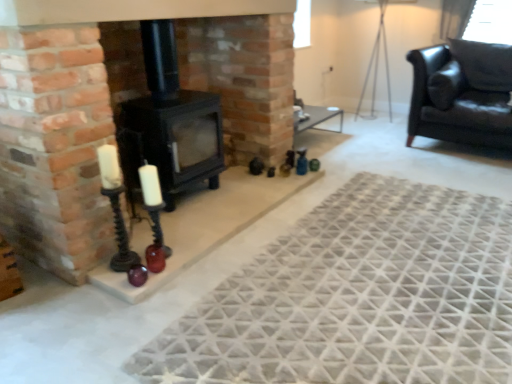
Question: Does point (128, 261) appear closer or farther from the camera than point (468, 274)?

Choices:
 (A) closer
 (B) farther

Answer: (B)

Question: From a real-world perspective, relative to textured gray rug at center, is black wrought iron candle holder at left, marked as the 1th candle holder in a left-to-right arrangement, vertically above or below?

Choices:
 (A) above
 (B) below

Answer: (A)

Question: Estimate the real-world distances between objects in this image. Which object is closer to the black wrought iron candle holder at left, marked as the 1th candle holder in a left-to-right arrangement?

Choices:
 (A) black glass candle holder at lower left, positioned as the 2th candle holder in left-to-right order
 (B) black matte wood burning stove at center
 (C) textured gray rug at center
 (D) black leather couch at upper right

Answer: (A)

Question: Which object is positioned farthest from the black matte wood burning stove at center?

Choices:
 (A) black glass candle holder at lower left, positioned as the 2th candle holder in left-to-right order
 (B) textured gray rug at center
 (C) black wrought iron candle holder at left, marked as the 2th candle holder in a right-to-left arrangement
 (D) black leather couch at upper right

Answer: (D)